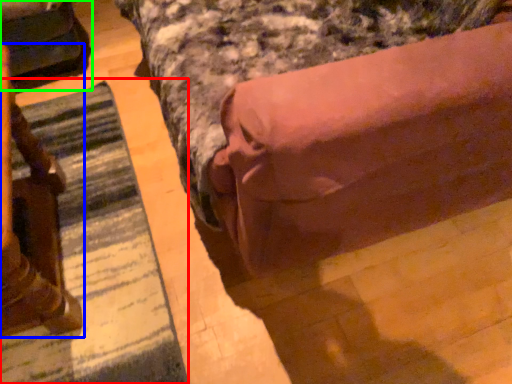
Question: Considering the real-world distances, which object is farthest from mat (highlighted by a red box)? furniture (highlighted by a blue box) or swivel chair (highlighted by a green box)?

Choices:
 (A) furniture
 (B) swivel chair

Answer: (B)